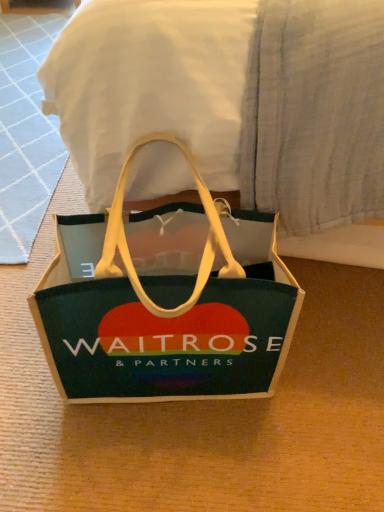
Question: Considering their positions, is white fabric at center located in front of or behind green felt bag at center?

Choices:
 (A) front
 (B) behind

Answer: (A)

Question: Looking at the image, does white fabric at center seem bigger or smaller compared to green felt bag at center?

Choices:
 (A) big
 (B) small

Answer: (A)

Question: Choose the correct answer: Is white fabric at center inside green felt bag at center or outside it?

Choices:
 (A) outside
 (B) inside

Answer: (A)

Question: Considering the positions of point (74, 247) and point (145, 164), is point (74, 247) closer or farther from the camera than point (145, 164)?

Choices:
 (A) farther
 (B) closer

Answer: (A)

Question: From their relative heights in the image, would you say green felt bag at center is taller or shorter than white fabric at center?

Choices:
 (A) short
 (B) tall

Answer: (A)

Question: Looking at their shapes, would you say green felt bag at center is wider or thinner than white fabric at center?

Choices:
 (A) wide
 (B) thin

Answer: (B)

Question: In the image, is green felt bag at center positioned in front of or behind white fabric at center?

Choices:
 (A) behind
 (B) front

Answer: (A)